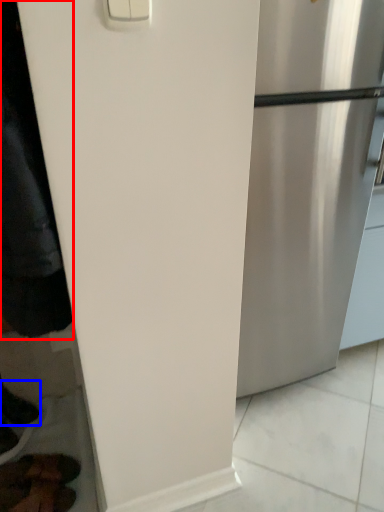
Question: Which of the following is the closest to the observer, jacket (highlighted by a red box) or shoe (highlighted by a blue box)?

Choices:
 (A) jacket
 (B) shoe

Answer: (A)